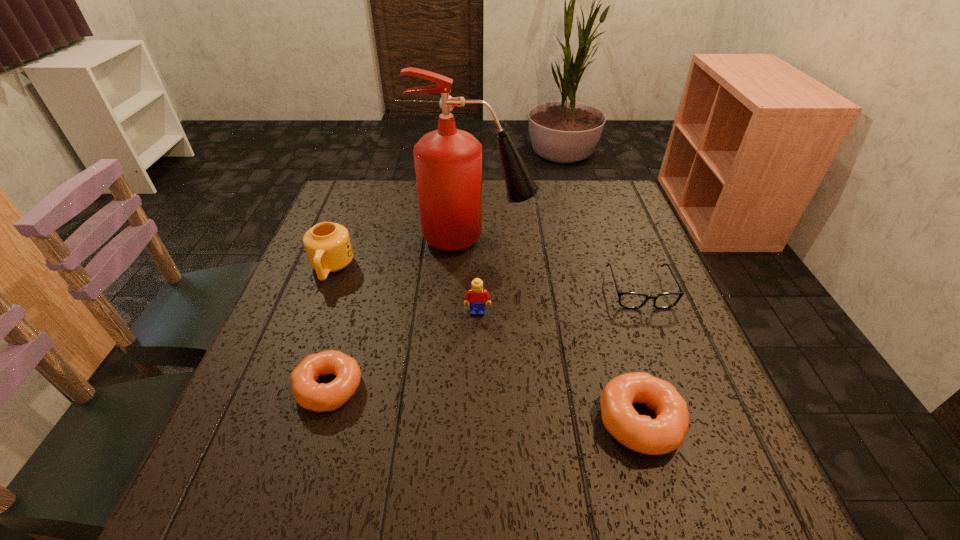
To achieve even spacing by inserting another doughnut among them, please point to a vacant spot for this new doughnut. Please provide its 2D coordinates. Your answer should be formatted as a tuple, i.e. [(x, y)], where the tuple contains the x and y coordinates of a point satisfying the conditions above.

[(480, 403)]